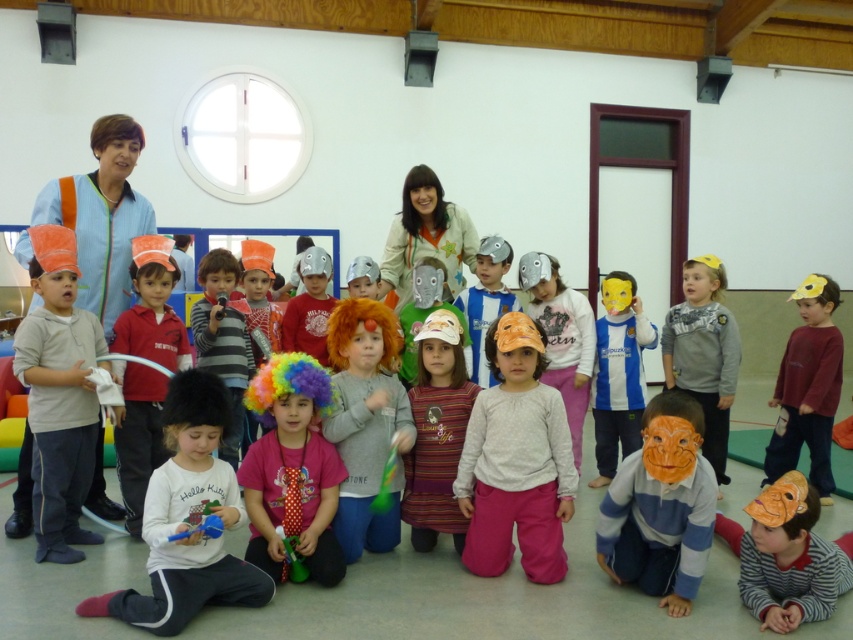
Does fluffy orange wig at center appear on the right side of matte yellow mask at center?

No, fluffy orange wig at center is not to the right of matte yellow mask at center.

Is point (347, 550) positioned in front of point (628, 408)?

Yes, point (347, 550) is in front of point (628, 408).

Who is more forward, (334,320) or (610,480)?

Point (334,320) is in front.

Where is `fluffy orange wig at center`? The image size is (853, 640). fluffy orange wig at center is located at coordinates (366, 420).

Is multicolored fluffy wig at center closer to camera compared to matte yellow paper hat at center?

Yes, it is in front of matte yellow paper hat at center.

You are a GUI agent. You are given a task and a screenshot of the screen. Output one action in this format:
    pyautogui.click(x=<x>, y=<y>)
    Task: Click on the multicolored fluffy wig at center
    The image size is (853, 640).
    Given the screenshot: What is the action you would take?
    pyautogui.click(x=292, y=468)

Image resolution: width=853 pixels, height=640 pixels. Describe the element at coordinates (292, 468) in the screenshot. I see `multicolored fluffy wig at center` at that location.

You are a GUI agent. You are given a task and a screenshot of the screen. Output one action in this format:
    pyautogui.click(x=<x>, y=<y>)
    Task: Click on the multicolored fluffy wig at center
    This screenshot has height=640, width=853.
    Given the screenshot: What is the action you would take?
    pyautogui.click(x=292, y=468)

Does matte orange hat at left appear on the right side of fluffy orange wig at center?

Incorrect, matte orange hat at left is not on the right side of fluffy orange wig at center.

Is point (45, 308) farther from camera compared to point (370, 364)?

No.

Between point (67, 508) and point (370, 364), which one is positioned behind?

The point (67, 508) is more distant.

This screenshot has width=853, height=640. I want to click on matte orange hat at left, so coord(57,394).